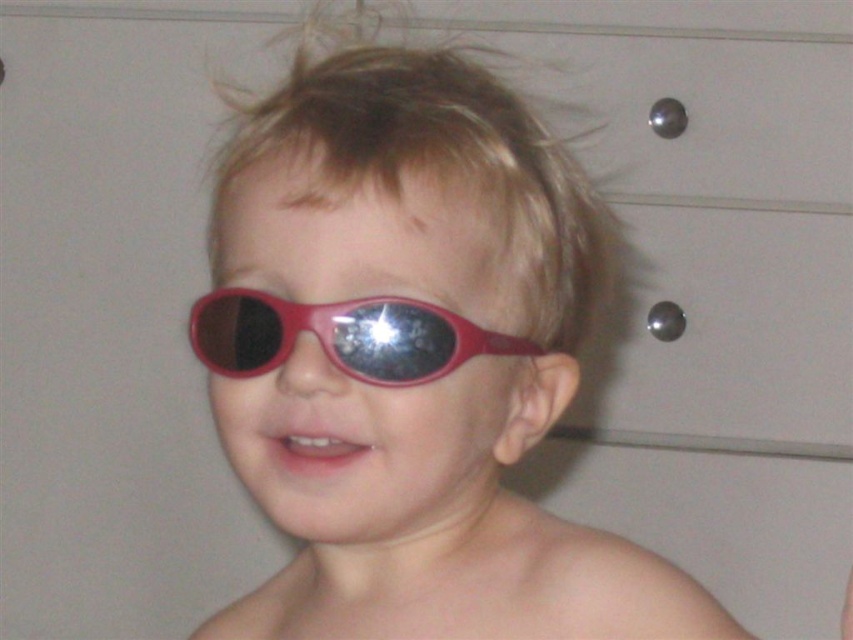
Is matte plastic sunglasses at center wider than shiny plastic goggles at center?

Yes, matte plastic sunglasses at center is wider than shiny plastic goggles at center.

Who is taller, matte plastic sunglasses at center or shiny plastic goggles at center?

matte plastic sunglasses at center

Locate an element on the screen. matte plastic sunglasses at center is located at coordinates (416, 362).

Find the location of `matte plastic sunglasses at center`. matte plastic sunglasses at center is located at coordinates (416, 362).